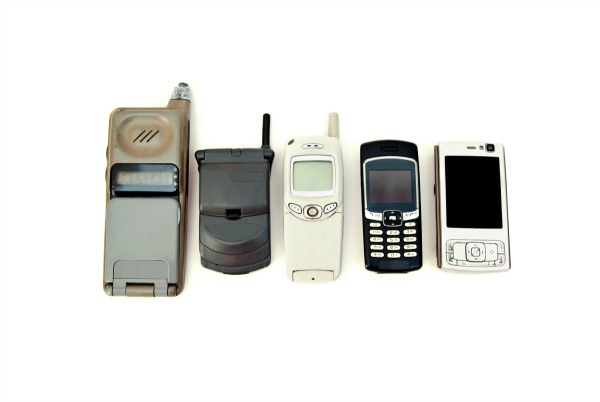
Where is `screen`? Image resolution: width=600 pixels, height=402 pixels. screen is located at coordinates (150, 182), (313, 174), (405, 182), (468, 202).